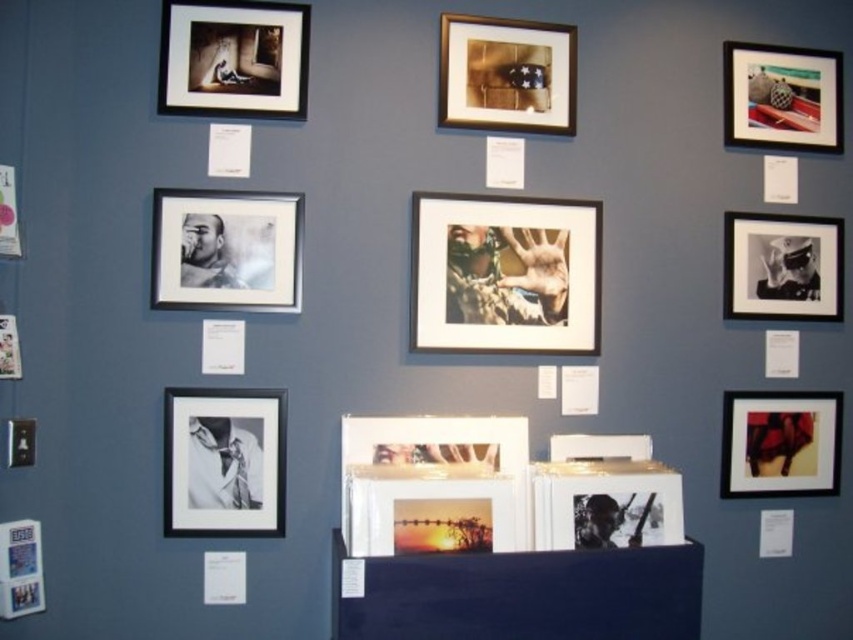
Question: Among these objects, which one is farthest from the camera?

Choices:
 (A) black glossy photograph at right
 (B) white glossy photo frame at center
 (C) matte black picture frame at lower left
 (D) black matte photo frame at lower left

Answer: (A)

Question: Does black matte photo frame at upper left have a larger size compared to black glossy photo frame at lower center?

Choices:
 (A) yes
 (B) no

Answer: (B)

Question: Can you confirm if black matte photo frame at lower left is positioned below matte black photograph at lower right?

Choices:
 (A) yes
 (B) no

Answer: (B)

Question: Is matte black frame at upper left to the right of matte plastic picture frame at upper right from the viewer's perspective?

Choices:
 (A) no
 (B) yes

Answer: (A)

Question: Which point is closer to the camera?

Choices:
 (A) matte plastic picture frame at upper right
 (B) black matte photo frame at upper left

Answer: (B)

Question: Which is nearer to the white glossy photo frame at center?

Choices:
 (A) matte plastic picture frame at upper right
 (B) black matte photo frame at lower left
 (C) black matte photo frame at upper left
 (D) matte black picture frame at lower left

Answer: (B)